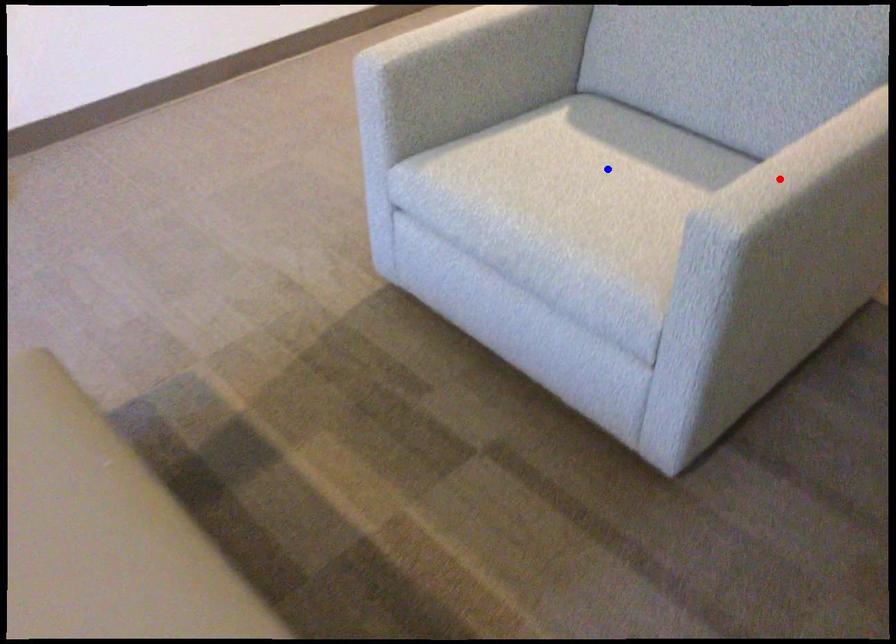
Question: In the image, two points are highlighted. Which point is nearer to the camera? Reply with the corresponding letter.

Choices:
 (A) blue point
 (B) red point

Answer: (B)